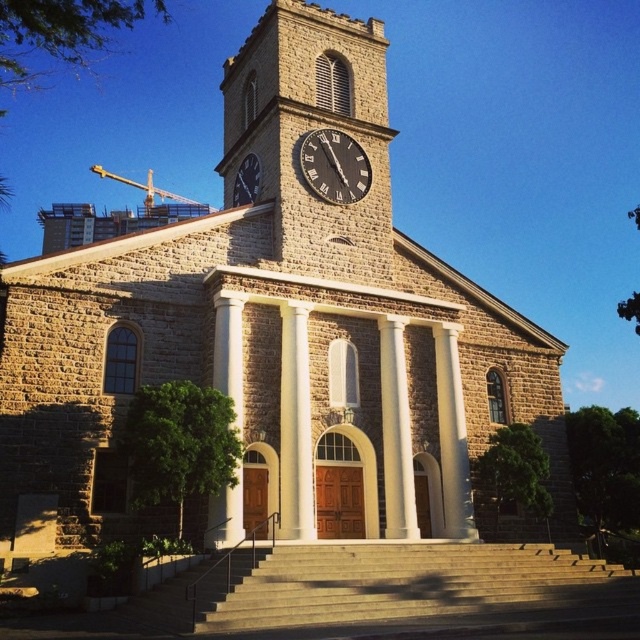
Is brown stone clock tower at upper center closer to camera compared to dark gray stone clock at upper center?

Yes, it is in front of dark gray stone clock at upper center.

Does brown stone clock tower at upper center appear on the left side of dark gray stone clock at upper center?

Indeed, brown stone clock tower at upper center is positioned on the left side of dark gray stone clock at upper center.

Image resolution: width=640 pixels, height=640 pixels. Describe the element at coordinates (314, 134) in the screenshot. I see `brown stone clock tower at upper center` at that location.

This screenshot has height=640, width=640. I want to click on brown stone clock tower at upper center, so click(x=314, y=134).

Does point (342, 166) come closer to viewer compared to point (259, 182)?

Yes, point (342, 166) is in front of point (259, 182).

Describe the element at coordinates (333, 166) in the screenshot. I see `black matte clock at center` at that location.

Is point (307, 163) farther from camera compared to point (250, 172)?

No, it is not.

Identify the location of black matte clock at center. (333, 166).

Locate an element on the screen. The image size is (640, 640). brown stone clock tower at upper center is located at coordinates (314, 134).

Where is `brown stone clock tower at upper center`? The image size is (640, 640). brown stone clock tower at upper center is located at coordinates (314, 134).